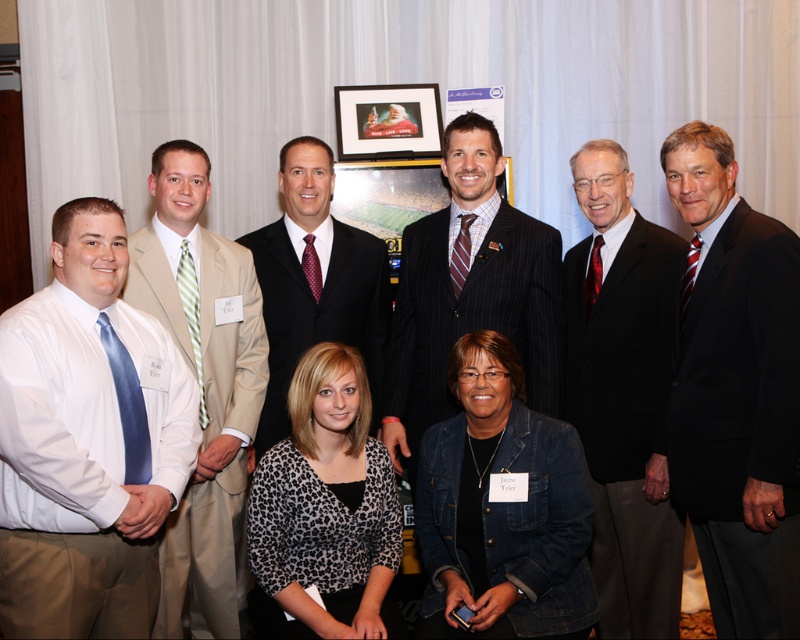
You are organizing a photo shoot and need to ensure that the denim jacket at lower right and the striped tie at center are visible in the frame. Given their sizes, which item might require more careful positioning to avoid being too small in the photo?

The denim jacket at lower right has a smaller width than the striped tie at center, so it might require more careful positioning to ensure it is not too small in the photo.

You are standing in front of the group photo and want to locate the white satin shirt at left. Where exactly is it positioned in the image?

The white satin shirt at left is positioned at point 0.692 on the x axis and 0.109 on the y axis.

You are a photographer who wants to ensure all participants are visible in the photo. There is a striped tie at center at point (470,291). Is there any object overlapping with the striped tie at center at that point?

The striped tie at center at point (470,291) is not mentioned to be overlapping with any other object in the scene description, so it is likely visible without obstruction.